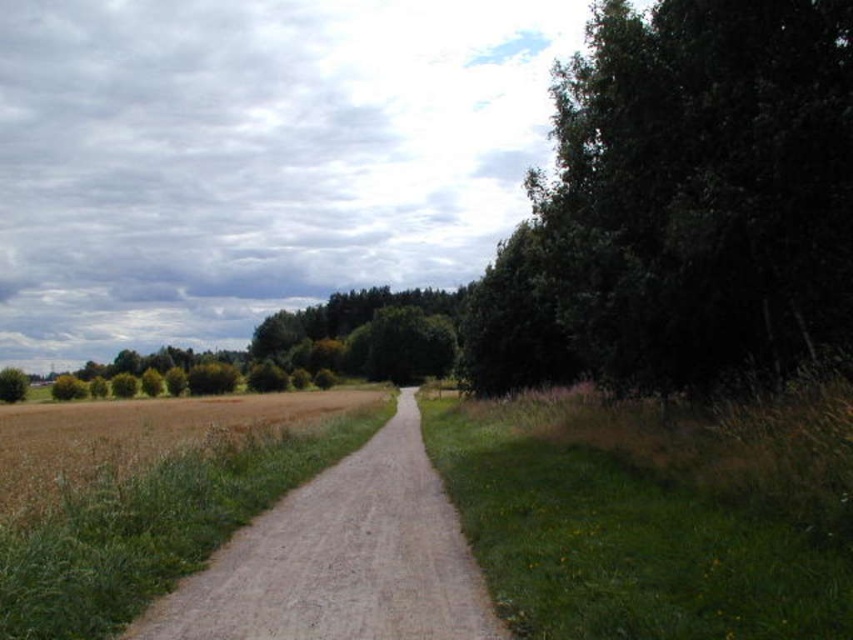
You are standing at the starting point of the dirt path in the rural scene. You notice two points marked on the path. The first point is at coordinate point(515,604) and the second point is at coordinate point(3,400). If you walk forward along the path, which point will you encounter first?

You will encounter the point at point(3,400) first because it is positioned behind point(515,604) along the path. Since the path stretches into the distance, the point closer to the viewer would be encountered later, while the one further away comes first when moving forward.

You are a hiker standing at the start of the dirt path. You notice the green grass at right and the green leafy tree at left. Which of these two objects is closer to you along the path?

The green grass at right is closer to you along the path because it is positioned over the green leafy tree at left, indicating it is in front.